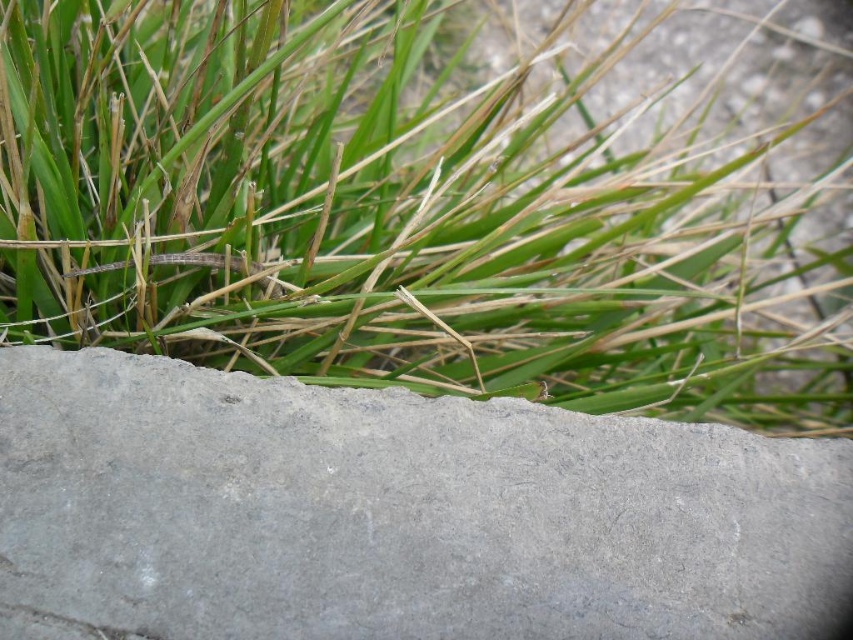
Can you confirm if green grass at upper center is taller than gray concrete at bottom?

Indeed, green grass at upper center has a greater height compared to gray concrete at bottom.

Who is positioned more to the left, green grass at upper center or gray concrete at bottom?

gray concrete at bottom is more to the left.

Between point (334, 134) and point (538, 548), which one is positioned in front?

Point (538, 548)

You are a GUI agent. You are given a task and a screenshot of the screen. Output one action in this format:
    pyautogui.click(x=<x>, y=<y>)
    Task: Click on the green grass at upper center
    This screenshot has width=853, height=640.
    Given the screenshot: What is the action you would take?
    pyautogui.click(x=381, y=216)